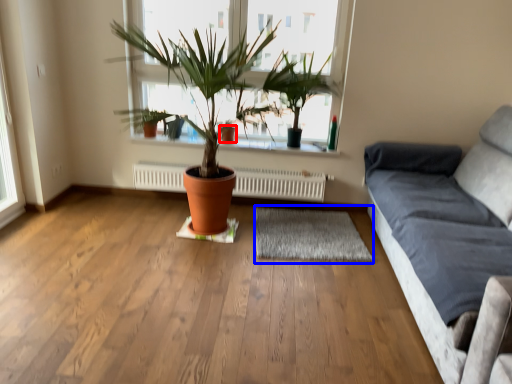
Question: Which point is closer to the camera, flowerpot (highlighted by a red box) or mat (highlighted by a blue box)?

Choices:
 (A) flowerpot
 (B) mat

Answer: (B)